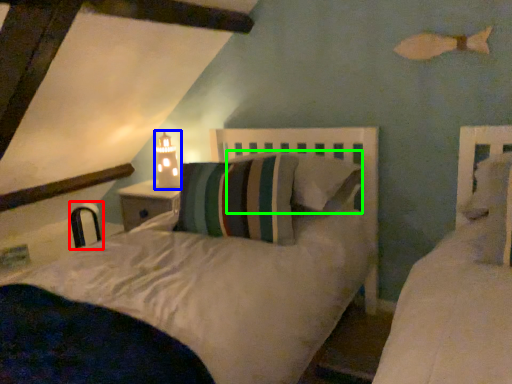
Question: Based on their relative distances, which object is farther from chair (highlighted by a red box)? Choose from table lamp (highlighted by a blue box) and pillow (highlighted by a green box).

Choices:
 (A) table lamp
 (B) pillow

Answer: (B)